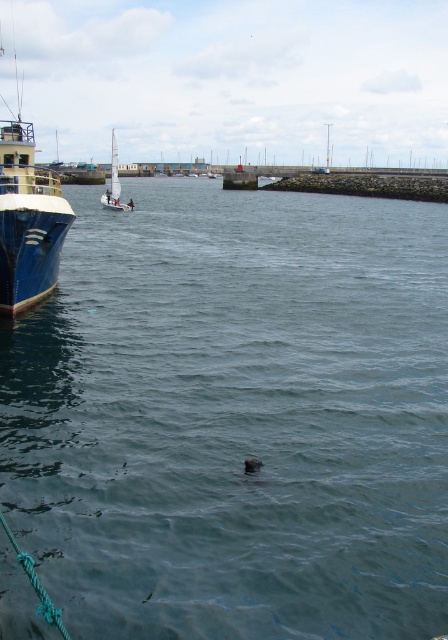
You are standing on a dock and see the clear blue water at center and the white sailboat at center. Which object is closer to the surface of the water?

The white sailboat at center is closer to the surface of the water because the clear blue water at center is below it.

You are standing on the dock and want to throw a fish to the seal. The seal is located at point (26, 304) and there is a boat at point (115, 157). Which point should you aim for to reach the seal first if you throw the fish in a straight line?

You should aim for point (26, 304) because it is closer to you than point (115, 157), so the fish will reach there first.